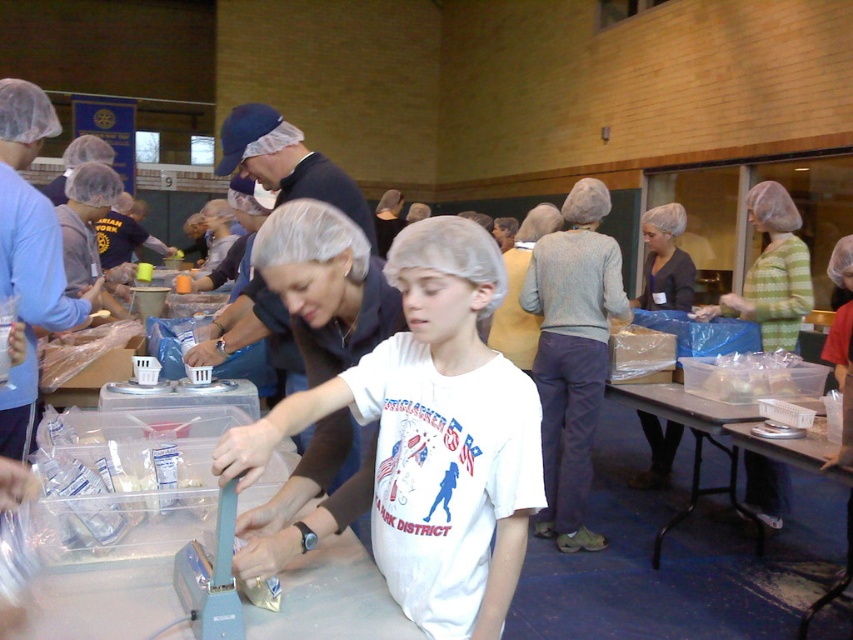
You are a volunteer at this event and need to place a 32 inch long banner between the matte black shirt at center and the translucent plastic container at lower right. Can you fit it there?

The distance between the matte black shirt at center and the translucent plastic container at lower right is 31.87 inches, so the banner cannot fit as it is slightly longer than the available space.

You are a photographer setting up a shoot in the gymnasium. You need to position a camera tripod so that both the matte black shirt at center and the translucent plastic container at lower right are in frame. Which object should you place closer to the front of the scene to ensure both are visible?

The matte black shirt at center is taller than the translucent plastic container at lower right, so you should place the taller matte black shirt at center closer to the front of the scene to ensure both are visible in the frame.